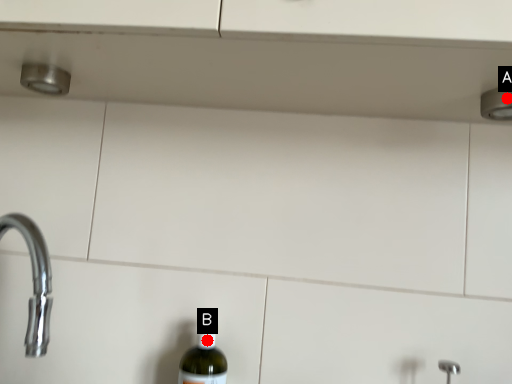
Question: Two points are circled on the image, labeled by A and B beside each circle. Which point is closer to the camera?

Choices:
 (A) A is closer
 (B) B is closer

Answer: (A)